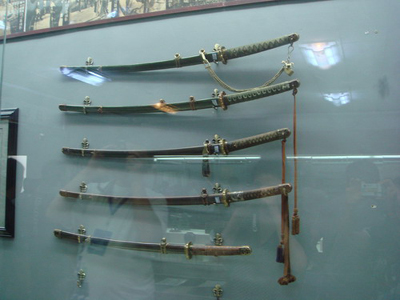
Where is `handle`? The image size is (400, 300). handle is located at coordinates (261, 139).